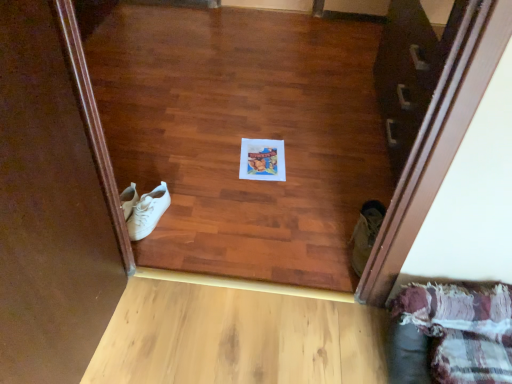
Question: From the image's perspective, is white leather sneakers at left, placed as the 1th footwear when sorted from left to right, above or below light wood plank at lower center?

Choices:
 (A) above
 (B) below

Answer: (A)

Question: Is white leather sneakers at left, acting as the 2th footwear starting from the right, in front of or behind light wood plank at lower center in the image?

Choices:
 (A) front
 (B) behind

Answer: (B)

Question: Which of these objects is positioned closest to the white leather sneakers at left, acting as the 2th footwear starting from the right?

Choices:
 (A) white paper at center
 (B) plaid fabric couch at lower right
 (C) light wood plank at lower center
 (D) wooden door at center
 (E) tan suede boot at lower right, the second footwear positioned from the left

Answer: (A)

Question: Based on their relative distances, which object is farther from the white leather sneakers at left, placed as the 1th footwear when sorted from left to right?

Choices:
 (A) light wood plank at lower center
 (B) tan suede boot at lower right, the second footwear positioned from the left
 (C) plaid fabric couch at lower right
 (D) white paper at center
 (E) wooden door at center

Answer: (E)